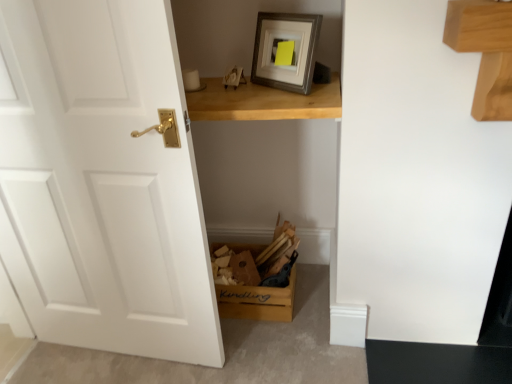
This screenshot has width=512, height=384. What do you see at coordinates (263, 102) in the screenshot? I see `light brown wooden table at upper center` at bounding box center [263, 102].

In order to face wooden kindling box at lower center, should I rotate leftwards or rightwards?

Turn left approximately 0.771 degrees to face it.

Where is `light brown wooden table at upper center`? This screenshot has width=512, height=384. light brown wooden table at upper center is located at coordinates 263,102.

Does wooden kindling box at lower center come behind light brown wooden table at upper center?

Yes, wooden kindling box at lower center is further from the viewer.

Is point (282, 301) more distant than point (334, 99)?

That is True.

Consider the image. From a real-world perspective, which is physically below, wooden kindling box at lower center or light brown wooden table at upper center?

In real-world perspective, wooden kindling box at lower center is lower.

Is wooden kindling box at lower center further to the viewer compared to white matte door at left?

That is True.

Is wooden kindling box at lower center oriented towards white matte door at left?

No, wooden kindling box at lower center is not aimed at white matte door at left.

From a real-world perspective, is wooden kindling box at lower center beneath white matte door at left?

Yes, from a real-world perspective, wooden kindling box at lower center is under white matte door at left.

Between wooden kindling box at lower center and white matte door at left, which one has larger size?

With larger size is white matte door at left.

From the image's perspective, is white matte door at left above or below light brown wooden table at upper center?

white matte door at left is situated lower than light brown wooden table at upper center in the image.

Is white matte door at left inside the boundaries of light brown wooden table at upper center, or outside?

white matte door at left is spatially situated outside light brown wooden table at upper center.

At what (x,y) coordinates should I click in order to perform the action: click on door that is on the left side of light brown wooden table at upper center. Please return your answer as a coordinate pair (x, y). Looking at the image, I should click on (103, 181).

Is white matte door at left beside light brown wooden table at upper center?

There is a gap between white matte door at left and light brown wooden table at upper center.

Considering the positions of objects light brown wooden table at upper center and white matte door at left in the image provided, who is more to the left, light brown wooden table at upper center or white matte door at left?

From the viewer's perspective, white matte door at left appears more on the left side.

Is light brown wooden table at upper center completely or partially outside of white matte door at left?

light brown wooden table at upper center is positioned outside white matte door at left.

Is point (332, 76) farther from camera compared to point (139, 47)?

Yes, it is behind point (139, 47).

Who is more distant, light brown wooden table at upper center or white matte door at left?

light brown wooden table at upper center.

Does white matte door at left turn towards wooden kindling box at lower center?

No, white matte door at left is not turned towards wooden kindling box at lower center.

Would you say white matte door at left is to the left or to the right of wooden kindling box at lower center in the picture?

white matte door at left is positioned on wooden kindling box at lower center's left side.

This screenshot has height=384, width=512. Find the location of `door that appears above the wooden kindling box at lower center (from the image's perspective)`. door that appears above the wooden kindling box at lower center (from the image's perspective) is located at coordinates (103, 181).

From a real-world perspective, is white matte door at left on top of wooden kindling box at lower center?

Yes, from a real-world perspective, white matte door at left is above wooden kindling box at lower center.

Can you confirm if light brown wooden table at upper center is positioned to the left of wooden kindling box at lower center?

Incorrect, light brown wooden table at upper center is not on the left side of wooden kindling box at lower center.

Is wooden kindling box at lower center surrounded by light brown wooden table at upper center?

No, wooden kindling box at lower center is located outside of light brown wooden table at upper center.

From the image's perspective, between light brown wooden table at upper center and wooden kindling box at lower center, which one is located above?

light brown wooden table at upper center appears higher in the image.

Considering the relative sizes of light brown wooden table at upper center and wooden kindling box at lower center in the image provided, is light brown wooden table at upper center taller than wooden kindling box at lower center?

In fact, light brown wooden table at upper center may be shorter than wooden kindling box at lower center.

This screenshot has height=384, width=512. In the image, there is a wooden kindling box at lower center. What are the coordinates of `table above it (from the image's perspective)` in the screenshot? It's located at (263, 102).

In the image, there is a white matte door at left. Where is `cardboard box below it (from the image's perspective)`? cardboard box below it (from the image's perspective) is located at coordinates (260, 278).

Looking at the image, which one is located closer to white matte door at left, wooden kindling box at lower center or light brown wooden table at upper center?

Among the two, light brown wooden table at upper center is located nearer to white matte door at left.

Looking at the image, which one is located further to wooden kindling box at lower center, light brown wooden table at upper center or white matte door at left?

light brown wooden table at upper center.

Based on their spatial positions, is white matte door at left or wooden kindling box at lower center closer to light brown wooden table at upper center?

white matte door at left is positioned closer to the anchor light brown wooden table at upper center.

Considering their positions, is light brown wooden table at upper center positioned further to white matte door at left than wooden kindling box at lower center?

Based on the image, wooden kindling box at lower center appears to be further to white matte door at left.

Estimate the real-world distances between objects in this image. Which object is closer to light brown wooden table at upper center, wooden kindling box at lower center or white matte door at left?

white matte door at left is positioned closer to the anchor light brown wooden table at upper center.

Which object lies nearer to the anchor point wooden kindling box at lower center, white matte door at left or light brown wooden table at upper center?

The object closer to wooden kindling box at lower center is white matte door at left.

This screenshot has height=384, width=512. Find the location of `table between white matte door at left and wooden kindling box at lower center in the front-back direction`. table between white matte door at left and wooden kindling box at lower center in the front-back direction is located at coordinates point(263,102).